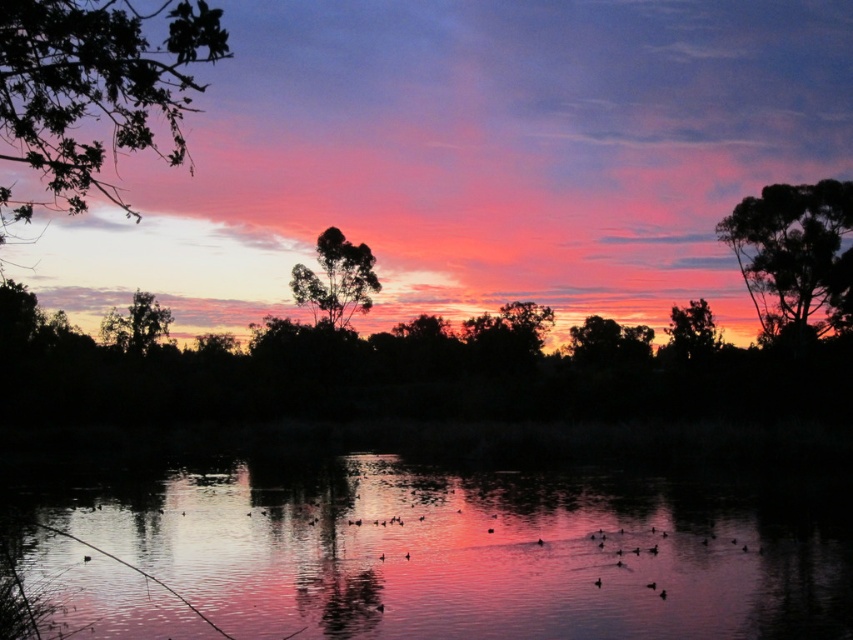
Looking at this image, you are an observer standing on the lakeshore. You notice the reflective water at center and the green leafy tree at left. Which object covers a wider area in the scene?

The reflective water at center covers a wider area than the green leafy tree at left because its width is larger.

You are standing on the shore and see the reflective water at center and the green leafy tree at left. Which object is closer to your right side?

The reflective water at center is closer to your right side because it is positioned to the right of the green leafy tree at left.

You are an observer looking at the sunset scene. There are two trees in the sky area. Which tree is positioned to the left when comparing dark green leafy tree at upper center and green leafy tree at upper right?

The dark green leafy tree at upper center is positioned to the left of the green leafy tree at upper right.